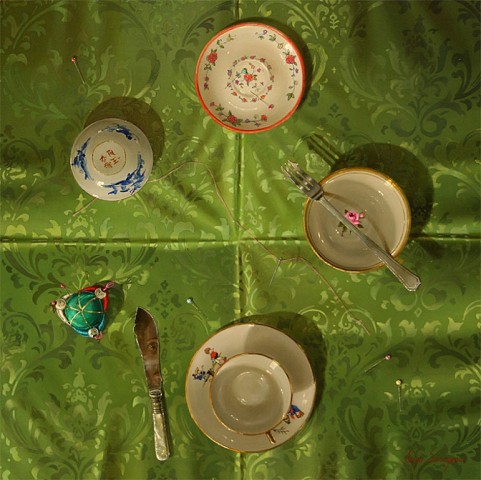
I want to click on bottom most saucer, so click(x=203, y=416).